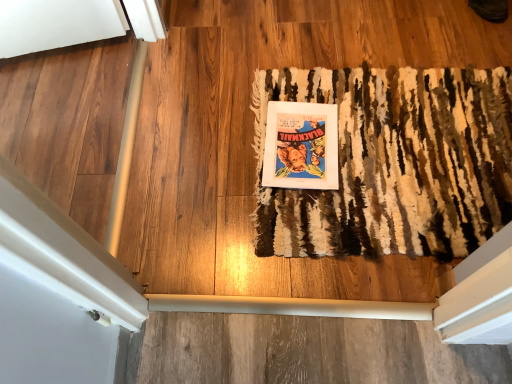
Question: Is matte paper poster at center facing away from rug at center?

Choices:
 (A) no
 (B) yes

Answer: (B)

Question: Can you see matte paper poster at center touching rug at center?

Choices:
 (A) no
 (B) yes

Answer: (A)

Question: Does matte paper poster at center have a smaller size compared to rug at center?

Choices:
 (A) yes
 (B) no

Answer: (A)

Question: Can you confirm if matte paper poster at center is thinner than rug at center?

Choices:
 (A) no
 (B) yes

Answer: (B)

Question: Can you confirm if matte paper poster at center is shorter than rug at center?

Choices:
 (A) yes
 (B) no

Answer: (B)

Question: Does matte paper poster at center come in front of rug at center?

Choices:
 (A) no
 (B) yes

Answer: (A)

Question: Considering the relative positions of rug at center and matte paper poster at center in the image provided, is rug at center to the right of matte paper poster at center from the viewer's perspective?

Choices:
 (A) no
 (B) yes

Answer: (B)

Question: Is rug at center positioned far away from matte paper poster at center?

Choices:
 (A) no
 (B) yes

Answer: (A)

Question: Considering the relative sizes of rug at center and matte paper poster at center in the image provided, is rug at center wider than matte paper poster at center?

Choices:
 (A) no
 (B) yes

Answer: (B)

Question: Is rug at center to the left of matte paper poster at center from the viewer's perspective?

Choices:
 (A) no
 (B) yes

Answer: (A)

Question: From a real-world perspective, does rug at center stand above matte paper poster at center?

Choices:
 (A) no
 (B) yes

Answer: (B)

Question: From the image's perspective, is rug at center located beneath matte paper poster at center?

Choices:
 (A) no
 (B) yes

Answer: (B)

Question: Is rug at center bigger or smaller than matte paper poster at center?

Choices:
 (A) small
 (B) big

Answer: (B)